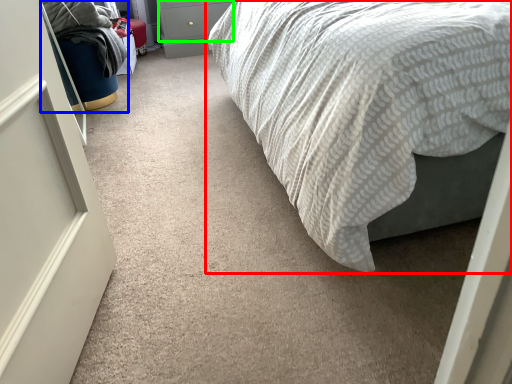
Question: Which is nearer to the bed (highlighted by a red box)? bean bag chair (highlighted by a blue box) or drawer (highlighted by a green box).

Choices:
 (A) bean bag chair
 (B) drawer

Answer: (A)